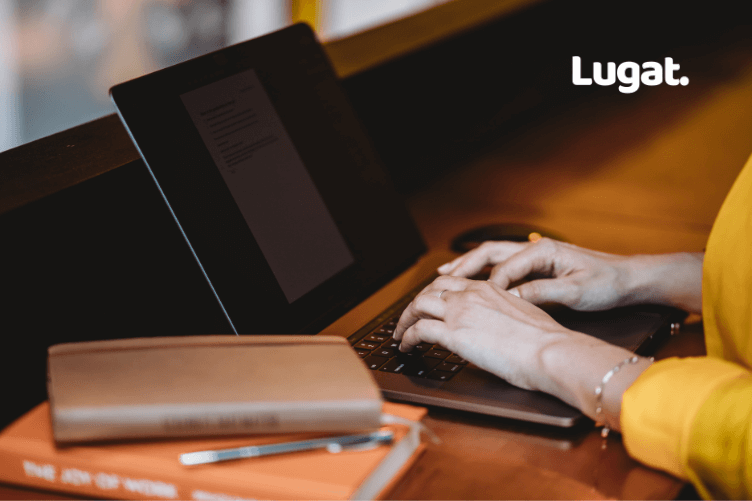
Find the location of `pen`. pen is located at coordinates (276, 448).